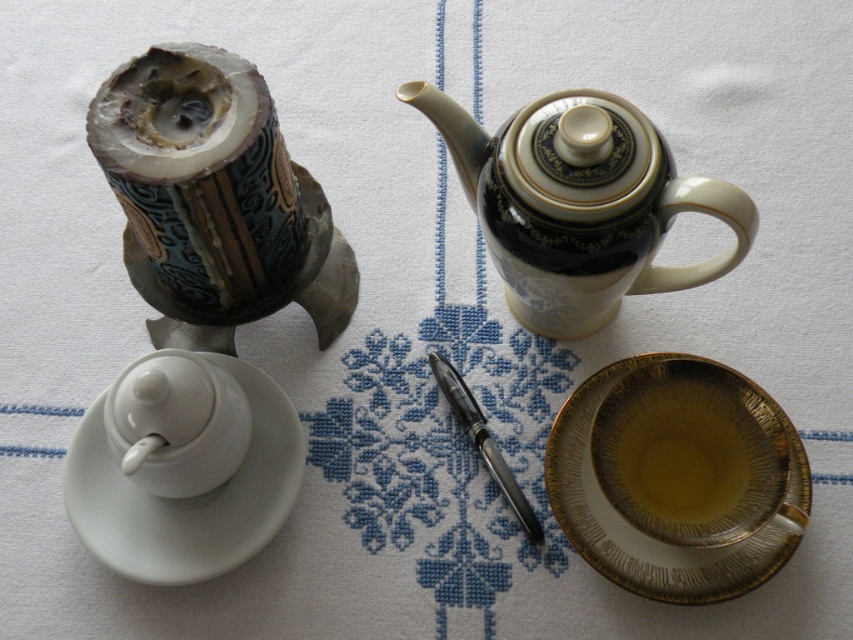
You are setting up a tea service and want to place the gold textured saucer at lower right and the black porcelain teapot at upper right on the table. If the saucer needs to be placed closer to the edge of the table than the teapot, which object should you position first to ensure proper placement?

The gold textured saucer at lower right has a lesser width compared to the black porcelain teapot at upper right. Since the saucer needs to be closer to the edge, you should position the black porcelain teapot at upper right first, then place the smaller saucer near the edge without overcrowding the space.

You are looking at the tea service items on the table. There are two points marked on the tablecloth. One is at coordinate point (683, 442) and the other at point (669, 161). Which point is closer to you?

Point (683, 442) is closer to you because it is further to the viewer than point (669, 161).